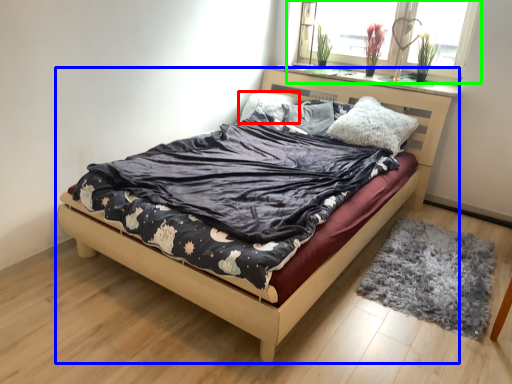
Question: Based on their relative distances, which object is farther from pillow (highlighted by a red box)? Choose from bed (highlighted by a blue box) and window (highlighted by a green box).

Choices:
 (A) bed
 (B) window

Answer: (A)